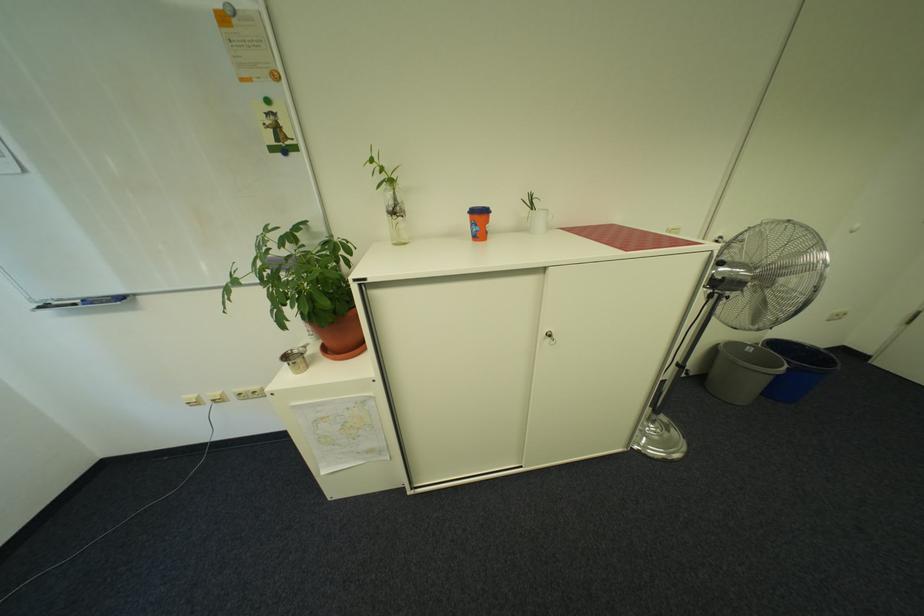
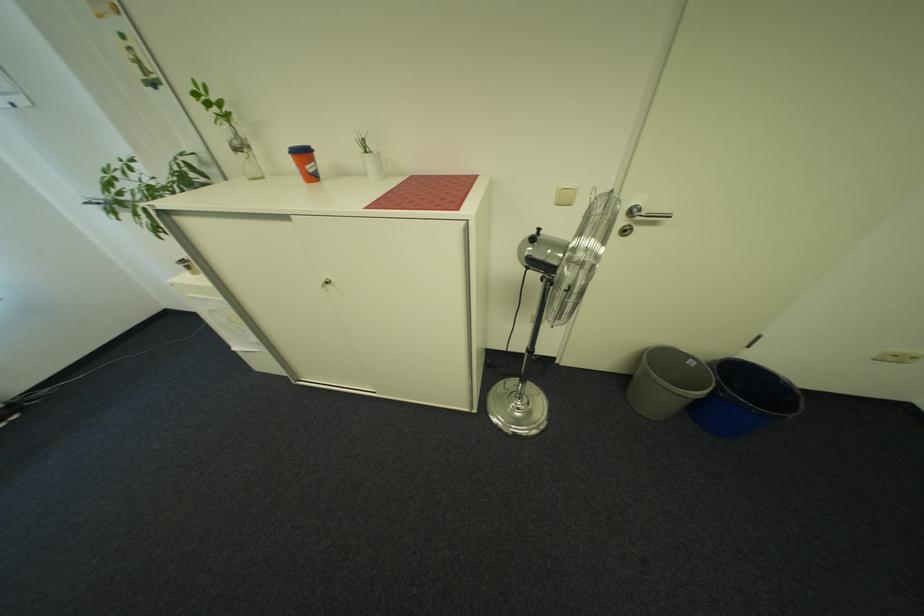
Find the pixel in the second image that matches pixel 496 227 in the first image.

(317, 168)